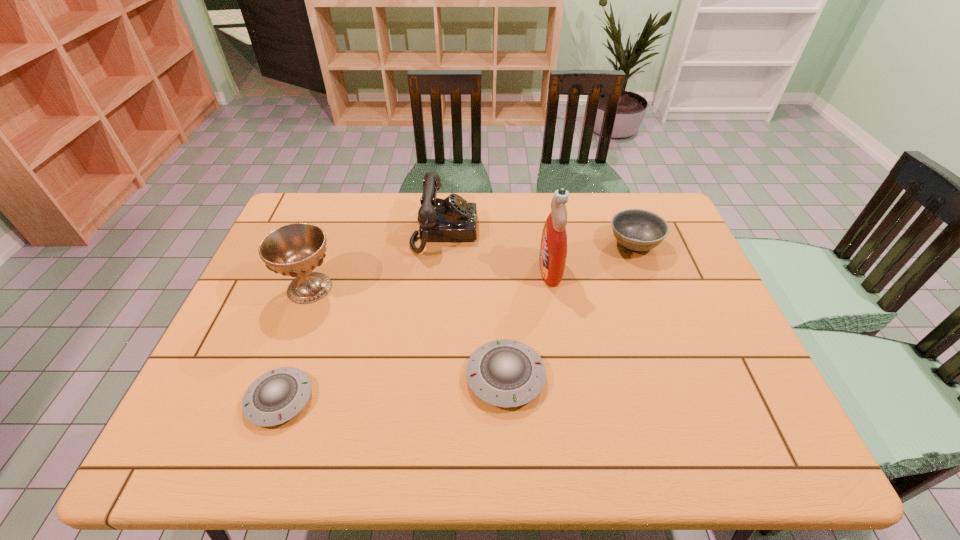
In order to click on the left saucer in this screenshot , I will do `click(278, 395)`.

This screenshot has width=960, height=540. Find the location of `the shortest object`. the shortest object is located at coordinates (278, 395).

Where is `the right saucer`? the right saucer is located at coordinates (505, 373).

This screenshot has height=540, width=960. I want to click on the second shortest object, so click(x=505, y=373).

Locate an element on the screen. telephone is located at coordinates (451, 219).

You are a GUI agent. You are given a task and a screenshot of the screen. Output one action in this format:
    pyautogui.click(x=<x>, y=<y>)
    Task: Click on the bowl
    This screenshot has width=960, height=540.
    Given the screenshot: What is the action you would take?
    pyautogui.click(x=637, y=230)

The width and height of the screenshot is (960, 540). Find the location of `the rightmost object`. the rightmost object is located at coordinates (637, 230).

The height and width of the screenshot is (540, 960). I want to click on the tallest object, so click(553, 249).

Identify the location of detergent. (553, 249).

This screenshot has height=540, width=960. I want to click on chalice, so click(295, 250).